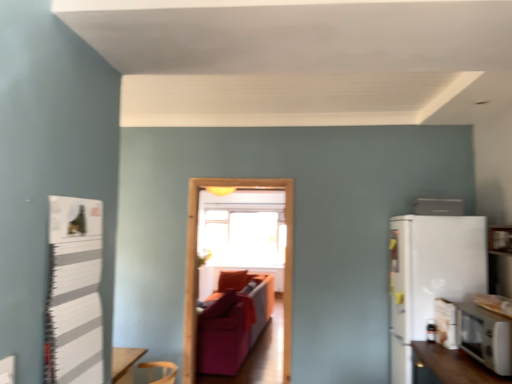
Question: Should I look upward or downward to see velvet red couch at center?

Choices:
 (A) down
 (B) up

Answer: (A)

Question: From a real-world perspective, is white matte refrigerator at right positioned over transparent glass window screen at center based on gravity?

Choices:
 (A) yes
 (B) no

Answer: (B)

Question: Considering the relative sizes of white matte refrigerator at right and transparent glass window screen at center in the image provided, is white matte refrigerator at right taller than transparent glass window screen at center?

Choices:
 (A) no
 (B) yes

Answer: (A)

Question: Does white matte refrigerator at right touch transparent glass window screen at center?

Choices:
 (A) no
 (B) yes

Answer: (A)

Question: From the image's perspective, is white matte refrigerator at right located beneath transparent glass window screen at center?

Choices:
 (A) yes
 (B) no

Answer: (B)

Question: From the image's perspective, is white matte refrigerator at right on transparent glass window screen at center?

Choices:
 (A) no
 (B) yes

Answer: (B)

Question: Considering the relative sizes of white matte refrigerator at right and transparent glass window screen at center in the image provided, is white matte refrigerator at right wider than transparent glass window screen at center?

Choices:
 (A) yes
 (B) no

Answer: (A)

Question: From a real-world perspective, is white striped bulletin board at left on white glossy microwave at lower right, the first appliance in the bottom-to-top sequence?

Choices:
 (A) yes
 (B) no

Answer: (A)

Question: Does white striped bulletin board at left have a smaller size compared to white glossy microwave at lower right, the first appliance in the bottom-to-top sequence?

Choices:
 (A) no
 (B) yes

Answer: (B)

Question: Is white striped bulletin board at left closer to camera compared to white glossy microwave at lower right, the first appliance in the bottom-to-top sequence?

Choices:
 (A) no
 (B) yes

Answer: (B)

Question: From the image's perspective, is white striped bulletin board at left above white glossy microwave at lower right, acting as the 2th appliance starting from the back?

Choices:
 (A) no
 (B) yes

Answer: (B)

Question: Is white striped bulletin board at left looking in the opposite direction of white glossy microwave at lower right, the 1th appliance in the front-to-back sequence?

Choices:
 (A) no
 (B) yes

Answer: (A)

Question: From the image's perspective, is white striped bulletin board at left located beneath white glossy microwave at lower right, the 2th appliance from the top?

Choices:
 (A) yes
 (B) no

Answer: (B)

Question: Can you confirm if white striped bulletin board at left is bigger than velvet red couch at center?

Choices:
 (A) yes
 (B) no

Answer: (B)